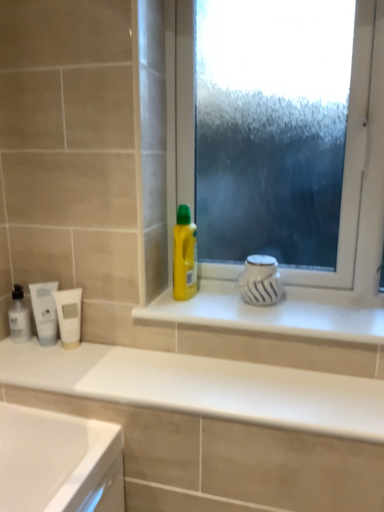
Question: Is white matte tube at left, which is the 2th mouthwash from right to left, with yellow plastic bottle at center?

Choices:
 (A) no
 (B) yes

Answer: (A)

Question: From the image's perspective, is white matte tube at left, which is the 2th mouthwash from right to left, over yellow plastic bottle at center?

Choices:
 (A) yes
 (B) no

Answer: (B)

Question: Considering the relative sizes of white matte tube at left, which is the 2th mouthwash from right to left, and yellow plastic bottle at center in the image provided, is white matte tube at left, which is the 2th mouthwash from right to left, shorter than yellow plastic bottle at center?

Choices:
 (A) no
 (B) yes

Answer: (B)

Question: Is white matte tube at left, the second mouthwash viewed from the left, behind yellow plastic bottle at center?

Choices:
 (A) yes
 (B) no

Answer: (B)

Question: Can you confirm if white matte tube at left, the second mouthwash viewed from the left, is smaller than yellow plastic bottle at center?

Choices:
 (A) no
 (B) yes

Answer: (B)

Question: Considering the relative sizes of white matte tube at left, the second mouthwash viewed from the left, and yellow plastic bottle at center in the image provided, is white matte tube at left, the second mouthwash viewed from the left, bigger than yellow plastic bottle at center?

Choices:
 (A) yes
 (B) no

Answer: (B)

Question: Is white glossy window sill at center to the left of frosted glass window at center from the viewer's perspective?

Choices:
 (A) yes
 (B) no

Answer: (A)

Question: From the image's perspective, is white glossy window sill at center below frosted glass window at center?

Choices:
 (A) yes
 (B) no

Answer: (A)

Question: Is white glossy window sill at center facing away from frosted glass window at center?

Choices:
 (A) no
 (B) yes

Answer: (A)

Question: Considering the relative sizes of white glossy window sill at center and frosted glass window at center in the image provided, is white glossy window sill at center bigger than frosted glass window at center?

Choices:
 (A) no
 (B) yes

Answer: (A)

Question: Does white glossy window sill at center lie behind frosted glass window at center?

Choices:
 (A) yes
 (B) no

Answer: (B)

Question: Does white glossy window sill at center lie in front of frosted glass window at center?

Choices:
 (A) yes
 (B) no

Answer: (A)

Question: Does frosted glass window at center have a greater width compared to translucent plastic mouthwash at left, which is counted as the first mouthwash, starting from the left?

Choices:
 (A) no
 (B) yes

Answer: (B)